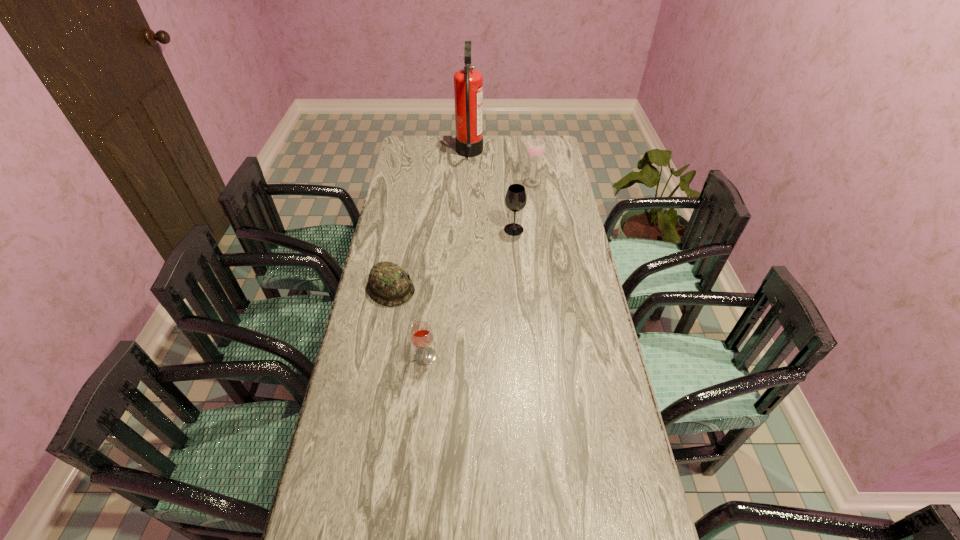
This screenshot has width=960, height=540. I want to click on the tallest object, so click(x=468, y=83).

Locate an element on the screen. This screenshot has width=960, height=540. the farthest object is located at coordinates click(468, 83).

You are a GUI agent. You are given a task and a screenshot of the screen. Output one action in this format:
    pyautogui.click(x=<x>, y=<y>)
    Task: Click on the second nearest wineglass
    
    Given the screenshot: What is the action you would take?
    pyautogui.click(x=515, y=199)

Identify the location of the fourth object from left to right. (515, 199).

This screenshot has width=960, height=540. Identify the location of the rightmost wineglass. (536, 148).

Image resolution: width=960 pixels, height=540 pixels. What are the coordinates of `the farthest wineglass` in the screenshot? It's located at (x=536, y=148).

The width and height of the screenshot is (960, 540). I want to click on the fourth object from right to left, so click(421, 334).

Find the location of a particular element. The width and height of the screenshot is (960, 540). the shortest wineglass is located at coordinates (421, 334).

You are a GUI agent. You are given a task and a screenshot of the screen. Output one action in this format:
    pyautogui.click(x=<x>, y=<y>)
    Task: Click on the headwear
    This screenshot has height=540, width=960.
    Given the screenshot: What is the action you would take?
    pyautogui.click(x=388, y=284)

The height and width of the screenshot is (540, 960). What are the coordinates of `the shortest object` in the screenshot? It's located at (388, 284).